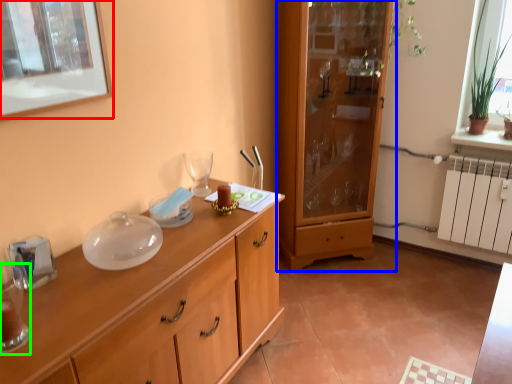
Question: Which object is positioned closest to picture frame (highlighted by a red box)? Select from cabinetry (highlighted by a blue box) and tableware (highlighted by a green box).

Choices:
 (A) cabinetry
 (B) tableware

Answer: (B)